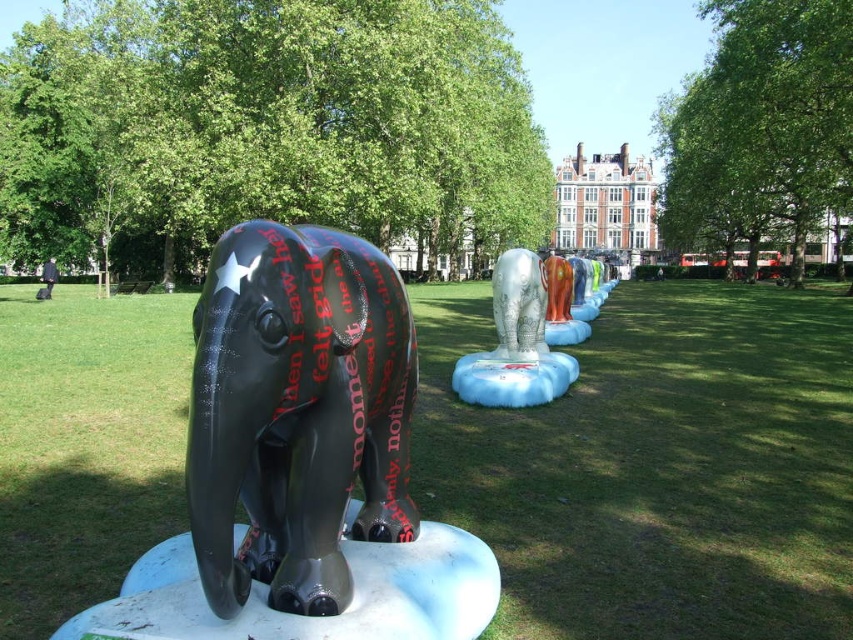
Is glossy black elephant at center taller than white glossy elephant at center?

Yes, glossy black elephant at center is taller than white glossy elephant at center.

Find the location of a particular element. The height and width of the screenshot is (640, 853). glossy black elephant at center is located at coordinates (297, 412).

Does glossy black elephant at center have a greater width compared to shiny silver elephant at center?

Correct, the width of glossy black elephant at center exceeds that of shiny silver elephant at center.

Is glossy black elephant at center below shiny silver elephant at center?

Correct, glossy black elephant at center is located below shiny silver elephant at center.

Locate an element on the screen. The width and height of the screenshot is (853, 640). glossy black elephant at center is located at coordinates (297, 412).

Is white glossy elephant at center positioned at the back of shiny silver elephant at center?

No, white glossy elephant at center is closer to the viewer.

Can you confirm if white glossy elephant at center is positioned to the right of shiny silver elephant at center?

Yes, white glossy elephant at center is to the right of shiny silver elephant at center.

I want to click on white glossy elephant at center, so click(515, 342).